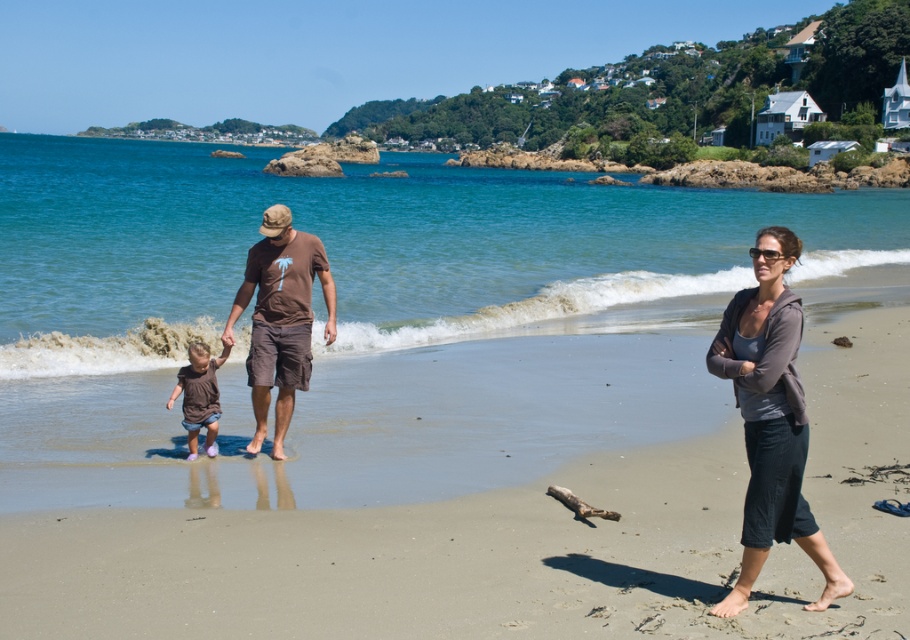
You are a photographer trying to capture a photo of the gray fleece jacket at right and the matte brown shorts at center. Based on their heights, which object should you focus on first if you want to ensure both are in frame without adjusting your camera angle?

The gray fleece jacket at right is shorter than the matte brown shorts at center, so you should focus on the matte brown shorts at center first to ensure both are in frame.